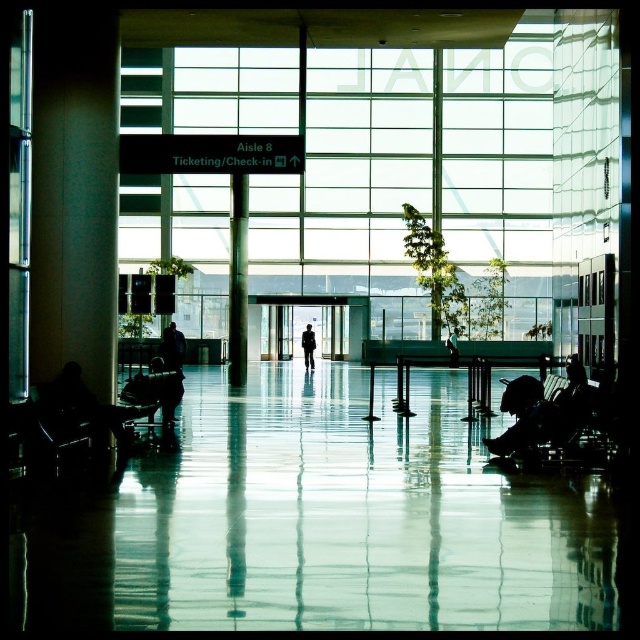
Which is more to the left, black suit at center or light brown leather jacket at center?

Positioned to the left is black suit at center.

Does black suit at center have a smaller size compared to light brown leather jacket at center?

Correct, black suit at center occupies less space than light brown leather jacket at center.

This screenshot has height=640, width=640. I want to click on black suit at center, so click(x=308, y=346).

The height and width of the screenshot is (640, 640). I want to click on dark blue jacket at center, so click(172, 348).

Can you confirm if dark blue jacket at center is thinner than light brown leather jacket at center?

Yes, dark blue jacket at center is thinner than light brown leather jacket at center.

Is point (163, 348) positioned behind point (451, 355)?

That is False.

The image size is (640, 640). Identify the location of dark blue jacket at center. (x=172, y=348).

Is point (122, 417) closer to viewer compared to point (236, 349)?

Yes, point (122, 417) is in front of point (236, 349).

Find the location of `silhouette figure at left`. silhouette figure at left is located at coordinates (84, 406).

This screenshot has width=640, height=640. Find the location of `silhouette figure at left`. silhouette figure at left is located at coordinates (84, 406).